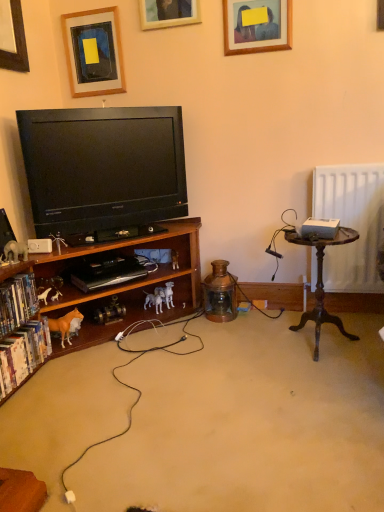
Identify the location of matte white elephant at lower left, which appears as the fourth toy when viewed from the back. (15, 251).

What do you see at coordinates (322, 283) in the screenshot?
I see `wooden vintage table at right` at bounding box center [322, 283].

Locate an element on the screen. This screenshot has width=384, height=512. brown plastic horse at lower left, arranged as the 3th toy when viewed from the right is located at coordinates (50, 289).

What is the approximate height of brown matte horse at lower left?

7.62 inches.

The width and height of the screenshot is (384, 512). What do you see at coordinates (66, 324) in the screenshot?
I see `brown matte horse at lower left` at bounding box center [66, 324].

Where is `matte white elephant at lower left, arranged as the first toy when viewed from the left`? matte white elephant at lower left, arranged as the first toy when viewed from the left is located at coordinates (15, 251).

Does white plastic dog at lower center, marked as the second toy in a right-to-left arrangement, lie in front of hardcover book at lower left, which is the first book from bottom to top?

No, white plastic dog at lower center, marked as the second toy in a right-to-left arrangement, is further to the viewer.

From the image's perspective, does white plastic dog at lower center, which is the first toy in back-to-front order, appear lower than hardcover book at lower left, which is the 2th book in top-to-bottom order?

No.

How different are the orientations of white plastic dog at lower center, marked as the second toy in a right-to-left arrangement, and hardcover book at lower left, which is the 2th book in top-to-bottom order, in degrees?

There is a 37.6-degree angle between the facing directions of white plastic dog at lower center, marked as the second toy in a right-to-left arrangement, and hardcover book at lower left, which is the 2th book in top-to-bottom order.

In terms of size, does white plastic dog at lower center, placed as the 4th toy when sorted from front to back, appear bigger or smaller than hardcover book at lower left, which is the first book from bottom to top?

Considering their sizes, white plastic dog at lower center, placed as the 4th toy when sorted from front to back, takes up less space than hardcover book at lower left, which is the first book from bottom to top.

Is the position of hardcover books at lower left, the 1th book viewed from the top, less distant than that of woodenmaterial/texture bookcase at left?

No, the depth of hardcover books at lower left, the 1th book viewed from the top, is greater than that of woodenmaterial/texture bookcase at left.

Does hardcover books at lower left, which is counted as the 2th book, starting from the bottom, have a smaller size compared to woodenmaterial/texture bookcase at left?

Yes.

What's the angular difference between hardcover books at lower left, the 1th book viewed from the top, and woodenmaterial/texture bookcase at left's facing directions?

3.72 degrees separate the facing orientations of hardcover books at lower left, the 1th book viewed from the top, and woodenmaterial/texture bookcase at left.

Is hardcover books at lower left, the 1th book viewed from the top, far away from woodenmaterial/texture bookcase at left?

They are positioned close to each other.

Between woodenmaterial/texture bookcase at left and copper glass lantern at center, the second toy when ordered from back to front, which one has more height?

woodenmaterial/texture bookcase at left.

Is the depth of woodenmaterial/texture bookcase at left greater than that of copper glass lantern at center, acting as the 4th toy starting from the left?

No.

In the image, is woodenmaterial/texture bookcase at left on the left side or the right side of copper glass lantern at center, which is the first toy from right to left?

Clearly, woodenmaterial/texture bookcase at left is on the left of copper glass lantern at center, which is the first toy from right to left, in the image.

How much distance is there between woodenmaterial/texture bookcase at left and copper glass lantern at center, which is the first toy from right to left?

They are 14.59 inches apart.

In the scene shown: Between wooden vintage table at right and white plastic dog at lower center, placed as the 4th toy when sorted from front to back, which one has smaller size?

white plastic dog at lower center, placed as the 4th toy when sorted from front to back, is smaller.

From the image's perspective, is wooden vintage table at right above white plastic dog at lower center, placed as the 4th toy when sorted from front to back?

Yes, from the image's perspective, wooden vintage table at right is over white plastic dog at lower center, placed as the 4th toy when sorted from front to back.

Which point is more distant from viewer, (349, 234) or (154, 300)?

Point (154, 300)

Is white plastic dog at lower center, which is the first toy in back-to-front order, smaller than brown matte horse at lower left?

Yes.

Considering their positions, is white plastic dog at lower center, which is the first toy in back-to-front order, located in front of or behind brown matte horse at lower left?

white plastic dog at lower center, which is the first toy in back-to-front order, is behind brown matte horse at lower left.

Is white plastic dog at lower center, marked as the second toy in a right-to-left arrangement, oriented away from brown matte horse at lower left?

No, white plastic dog at lower center, marked as the second toy in a right-to-left arrangement,'s orientation is not away from brown matte horse at lower left.

From a real-world perspective, is white plastic dog at lower center, placed as the 4th toy when sorted from front to back, above or below brown matte horse at lower left?

Clearly, from a real-world perspective, white plastic dog at lower center, placed as the 4th toy when sorted from front to back, is below brown matte horse at lower left.

Who is smaller, woodenmaterial/texture bookcase at left or wooden vintage table at right?

With smaller size is wooden vintage table at right.

Is woodenmaterial/texture bookcase at left in front of wooden vintage table at right?

Yes, woodenmaterial/texture bookcase at left is in front of wooden vintage table at right.

Is woodenmaterial/texture bookcase at left turned away from wooden vintage table at right?

No.

Is there a large distance between woodenmaterial/texture bookcase at left and wooden vintage table at right?

That's not correct — woodenmaterial/texture bookcase at left is a little close to wooden vintage table at right.

Does wooden picture frame at upper center, positioned as the second picture frame in right-to-left order, have a greater width compared to copper glass lantern at center, which is the first toy from right to left?

In fact, wooden picture frame at upper center, positioned as the second picture frame in right-to-left order, might be narrower than copper glass lantern at center, which is the first toy from right to left.

Which is behind, point (183, 3) or point (209, 301)?

The point (209, 301) is farther.

From the image's perspective, which object appears higher, wooden picture frame at upper center, positioned as the second picture frame in right-to-left order, or copper glass lantern at center, the third toy when ordered from front to back?

wooden picture frame at upper center, positioned as the second picture frame in right-to-left order.

Between wooden picture frame at upper center, acting as the 2th picture frame starting from the left, and copper glass lantern at center, the second toy when ordered from back to front, which one has larger size?

With larger size is copper glass lantern at center, the second toy when ordered from back to front.

In the image, there is a white plastic dog at lower center, placed as the 4th toy when sorted from front to back. At what (x,y) coordinates should I click in order to perform the action: click on book below it (from the image's perspective). Please return your answer as a coordinate pair (x, y). The width and height of the screenshot is (384, 512). Looking at the image, I should click on (23, 354).

Locate an element on the screen. This screenshot has height=512, width=384. book lying above the woodenmaterial/texture bookcase at left (from the image's perspective) is located at coordinates (17, 302).

Looking at the image, which one is located further to wooden picture frame at upper center, which ranks as the 1th picture frame in right-to-left order, woodenmaterial/texture bookcase at left or brown matte horse at lower left?

brown matte horse at lower left lies further to wooden picture frame at upper center, which ranks as the 1th picture frame in right-to-left order, than the other object.

Considering their positions, is wooden picture frame at upper center, positioned as the 3th picture frame in left-to-right order, positioned further to copper glass lantern at center, the third toy when ordered from front to back, than wooden picture frame at upper left, which ranks as the third picture frame in right-to-left order?

The object further to copper glass lantern at center, the third toy when ordered from front to back, is wooden picture frame at upper left, which ranks as the third picture frame in right-to-left order.

Based on their spatial positions, is wooden picture frame at upper left, which is the 1th picture frame in left-to-right order, or woodenmaterial/texture bookcase at left further from wooden picture frame at upper center, acting as the 2th picture frame starting from the left?

woodenmaterial/texture bookcase at left is further to wooden picture frame at upper center, acting as the 2th picture frame starting from the left.

Considering their positions, is brown plastic horse at lower left, arranged as the 3th toy when viewed from the right, positioned closer to black glossy television at left than wooden vintage table at right?

brown plastic horse at lower left, arranged as the 3th toy when viewed from the right, lies closer to black glossy television at left than the other object.

Considering their positions, is brown plastic horse at lower left, the second toy from the front, positioned further to wooden vintage table at right than copper glass lantern at center, acting as the 4th toy starting from the left?

The object further to wooden vintage table at right is brown plastic horse at lower left, the second toy from the front.

Looking at the image, which one is located closer to white plastic dog at lower center, which is the first toy in back-to-front order, wooden picture frame at upper left, which is the 1th picture frame in left-to-right order, or hardcover book at lower left, which is the 2th book in top-to-bottom order?

hardcover book at lower left, which is the 2th book in top-to-bottom order.

Estimate the real-world distances between objects in this image. Which object is closer to black glossy television at left, white plastic dog at lower center, which is the first toy in back-to-front order, or wooden picture frame at upper left, which ranks as the third picture frame in right-to-left order?

wooden picture frame at upper left, which ranks as the third picture frame in right-to-left order, is positioned closer to the anchor black glossy television at left.

When comparing their distances from hardcover book at lower left, which is the first book from bottom to top, does matte white elephant at lower left, arranged as the first toy when viewed from the left, or brown matte horse at lower left seem closer?

brown matte horse at lower left is closer to hardcover book at lower left, which is the first book from bottom to top.

You are a GUI agent. You are given a task and a screenshot of the screen. Output one action in this format:
    pyautogui.click(x=<x>, y=<y>)
    Task: Click on the toy between hardcover books at lower left, the 1th book viewed from the top, and brown matte horse at lower left in the front-back direction
    This screenshot has width=384, height=512.
    Given the screenshot: What is the action you would take?
    pyautogui.click(x=15, y=251)

Where is `table between wooden picture frame at upper left, which ranks as the third picture frame in right-to-left order, and woodenmaterial/texture bookcase at left in the up-down direction`? table between wooden picture frame at upper left, which ranks as the third picture frame in right-to-left order, and woodenmaterial/texture bookcase at left in the up-down direction is located at coordinates (322, 283).

Locate an element on the screen. Image resolution: width=384 pixels, height=512 pixels. animal between woodenmaterial/texture bookcase at left and copper glass lantern at center, acting as the 4th toy starting from the left, along the z-axis is located at coordinates (66, 324).

Locate an element on the screen. Image resolution: width=384 pixels, height=512 pixels. picture frame between wooden picture frame at upper center, which ranks as the 1th picture frame in right-to-left order, and matte white elephant at lower left, which ranks as the 1th toy in front-to-back order, in the up-down direction is located at coordinates (94, 52).